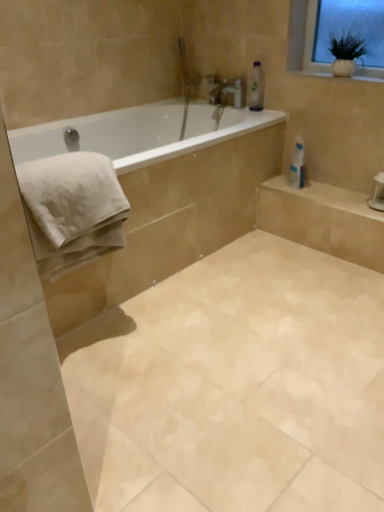
Question: Considering the relative positions of white ceramic vase at upper right and white cotton towel at left in the image provided, is white ceramic vase at upper right behind white cotton towel at left?

Choices:
 (A) no
 (B) yes

Answer: (B)

Question: Could you tell me if white ceramic vase at upper right is turned towards white cotton towel at left?

Choices:
 (A) no
 (B) yes

Answer: (A)

Question: Considering the relative sizes of white ceramic vase at upper right and white cotton towel at left in the image provided, is white ceramic vase at upper right taller than white cotton towel at left?

Choices:
 (A) no
 (B) yes

Answer: (A)

Question: Is white ceramic vase at upper right outside of white cotton towel at left?

Choices:
 (A) no
 (B) yes

Answer: (B)

Question: Are white ceramic vase at upper right and white cotton towel at left located far from each other?

Choices:
 (A) no
 (B) yes

Answer: (B)

Question: From the image's perspective, is white cotton towel at left positioned above or below beige marble tile at center?

Choices:
 (A) above
 (B) below

Answer: (A)

Question: In terms of width, does white cotton towel at left look wider or thinner when compared to beige marble tile at center?

Choices:
 (A) thin
 (B) wide

Answer: (A)

Question: Is point (71, 180) positioned closer to the camera than point (211, 482)?

Choices:
 (A) closer
 (B) farther

Answer: (B)

Question: In terms of height, does white cotton towel at left look taller or shorter compared to beige marble tile at center?

Choices:
 (A) short
 (B) tall

Answer: (B)

Question: Relative to white glossy soap dispenser at upper right, is white cotton towel at left in front or behind?

Choices:
 (A) front
 (B) behind

Answer: (A)

Question: Is white cotton towel at left spatially inside white glossy soap dispenser at upper right, or outside of it?

Choices:
 (A) outside
 (B) inside

Answer: (A)

Question: From a real-world perspective, relative to white glossy soap dispenser at upper right, is white cotton towel at left vertically above or below?

Choices:
 (A) below
 (B) above

Answer: (B)

Question: Considering the positions of white cotton towel at left and white glossy soap dispenser at upper right in the image, is white cotton towel at left taller or shorter than white glossy soap dispenser at upper right?

Choices:
 (A) tall
 (B) short

Answer: (A)

Question: Considering the positions of white ceramic vase at upper right and white cotton towel at left in the image, is white ceramic vase at upper right bigger or smaller than white cotton towel at left?

Choices:
 (A) small
 (B) big

Answer: (A)

Question: Is white ceramic vase at upper right spatially inside white cotton towel at left, or outside of it?

Choices:
 (A) inside
 (B) outside

Answer: (B)